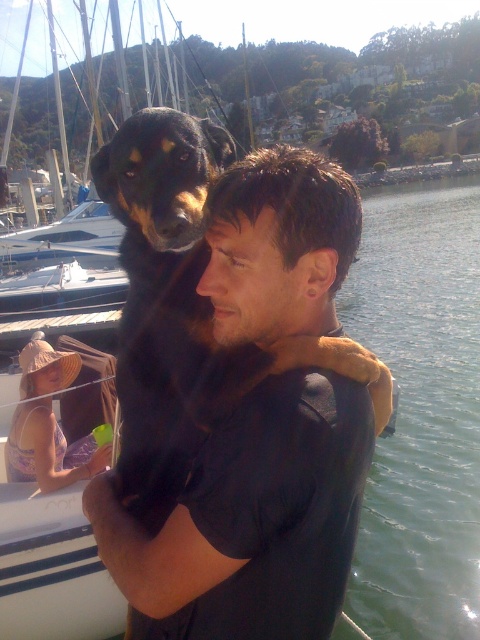
Question: Can you confirm if green water at center is positioned below black fur dog at center?

Choices:
 (A) no
 (B) yes

Answer: (A)

Question: From the image, what is the correct spatial relationship of green water at center in relation to black fur dog at center?

Choices:
 (A) right
 (B) left

Answer: (A)

Question: Which point is closer to the camera?

Choices:
 (A) (459, 257)
 (B) (163, 428)

Answer: (B)

Question: Is green water at center wider than black fur dog at center?

Choices:
 (A) no
 (B) yes

Answer: (B)

Question: Which point is closer to the camera?

Choices:
 (A) (470, 572)
 (B) (171, 275)

Answer: (B)